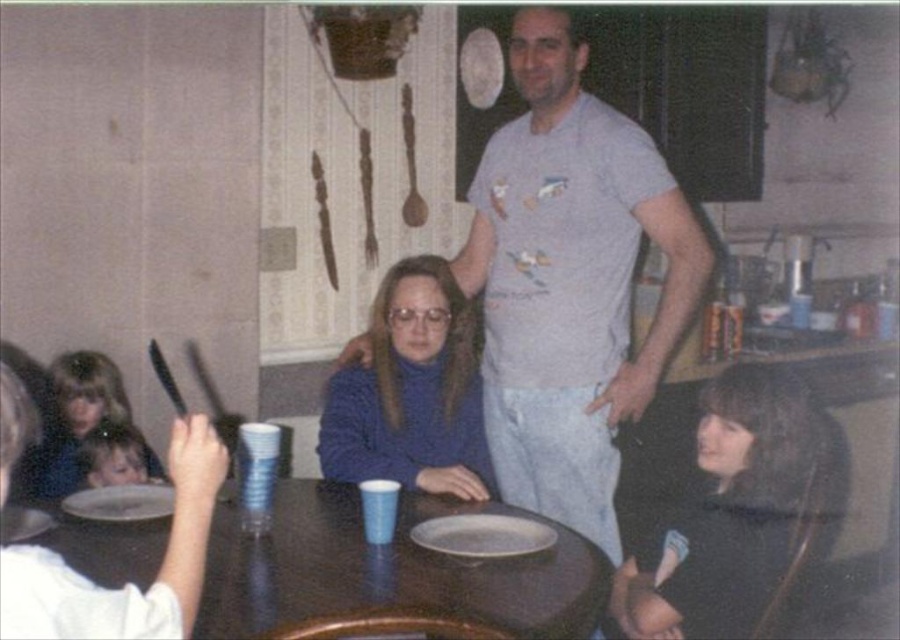
Is white matte plate at center further to camera compared to white matte plate at table center?

That is False.

Can you confirm if white matte plate at center is positioned above white matte plate at table center?

Incorrect, white matte plate at center is not positioned above white matte plate at table center.

The height and width of the screenshot is (640, 900). What are the coordinates of `white matte plate at center` in the screenshot? It's located at (483, 536).

Locate an element on the screen. The height and width of the screenshot is (640, 900). white matte plate at center is located at coordinates (483, 536).

Between brown wooden table at center and white matte plate at center, which one has more height?

brown wooden table at center

Is point (595, 608) farther from camera compared to point (513, 518)?

That is False.

Find the location of `brown wooden table at center`. brown wooden table at center is located at coordinates (387, 570).

Can you confirm if gray cotton t-shirt at center is wider than white matte plate at lower left?

Yes, gray cotton t-shirt at center is wider than white matte plate at lower left.

Can you confirm if gray cotton t-shirt at center is positioned to the left of white matte plate at lower left?

No, gray cotton t-shirt at center is not to the left of white matte plate at lower left.

Between point (533, 456) and point (4, 531), which one is positioned in front?

Point (4, 531) is in front.

Image resolution: width=900 pixels, height=640 pixels. I want to click on gray cotton t-shirt at center, so click(x=570, y=280).